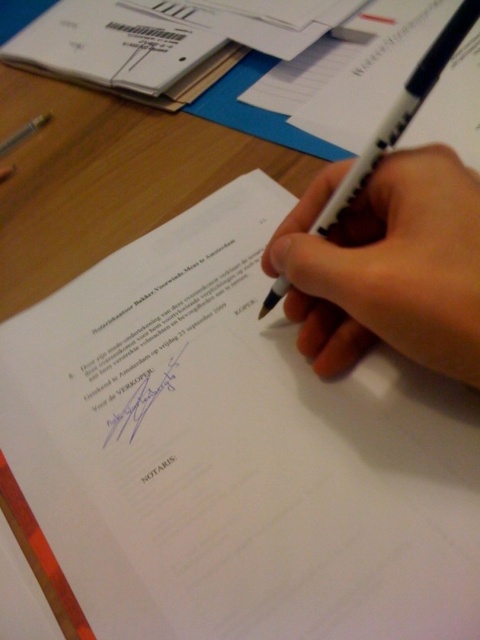
Question: Does white matte pen at center have a smaller size compared to white plastic pen at center?

Choices:
 (A) yes
 (B) no

Answer: (A)

Question: Considering the relative positions of white matte pen at center and white plastic pen at center in the image provided, where is white matte pen at center located with respect to white plastic pen at center?

Choices:
 (A) left
 (B) right

Answer: (A)

Question: Which object appears farthest from the camera in this image?

Choices:
 (A) white matte pen at center
 (B) white plastic pen at center

Answer: (B)

Question: Can you confirm if white matte pen at center is smaller than white plastic pen at center?

Choices:
 (A) yes
 (B) no

Answer: (A)